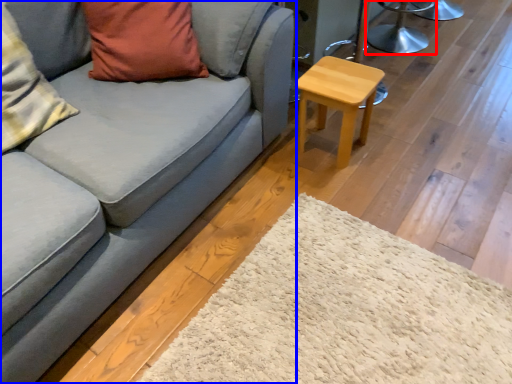
Question: Which point is closer to the camera, swivel chair (highlighted by a red box) or studio couch (highlighted by a blue box)?

Choices:
 (A) swivel chair
 (B) studio couch

Answer: (B)